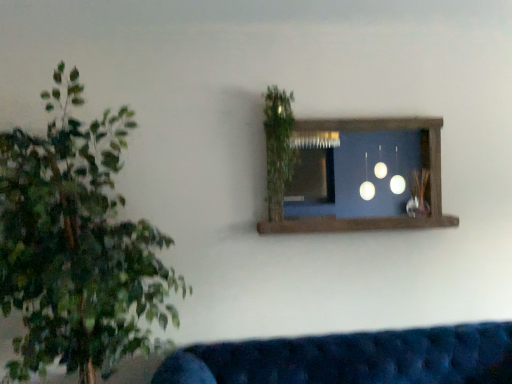
The height and width of the screenshot is (384, 512). I want to click on vacant area on top of brown wooden window frame at upper center (from a real-world perspective), so click(353, 112).